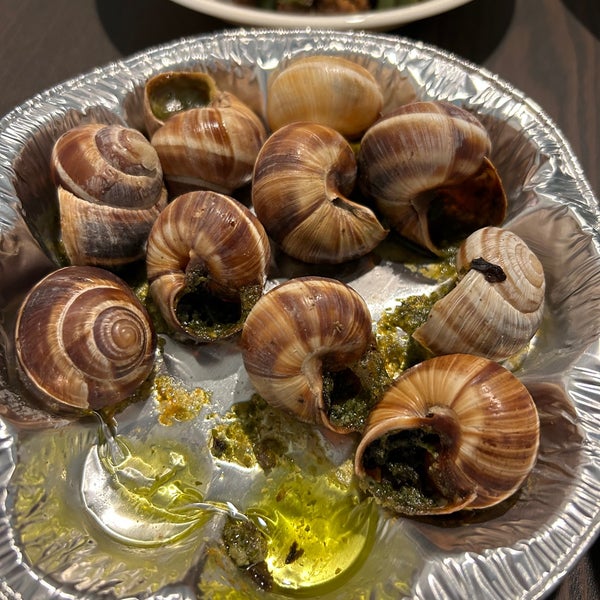
Where is `shadow from white plate`? This screenshot has width=600, height=600. shadow from white plate is located at coordinates (135, 30).